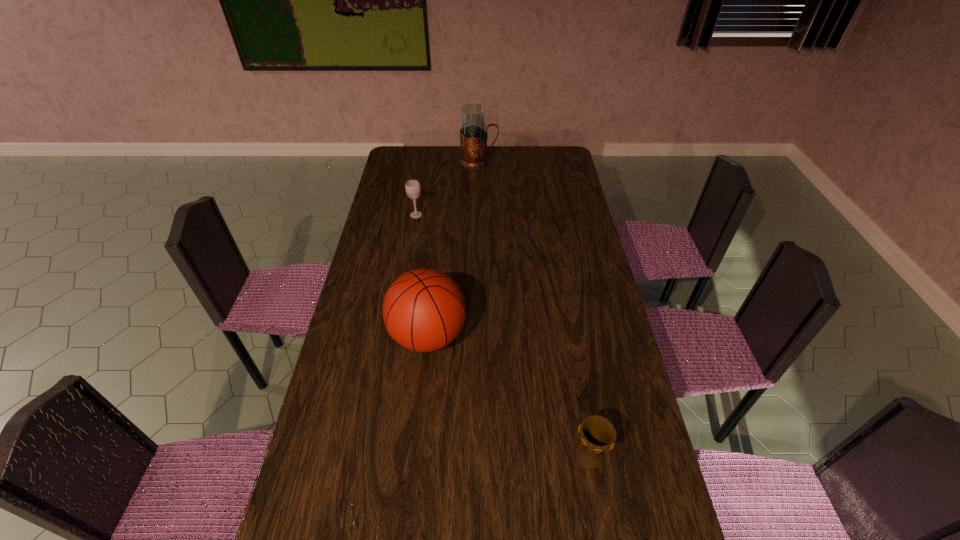
Where is `pitcher`? Image resolution: width=960 pixels, height=540 pixels. pitcher is located at coordinates (473, 133).

This screenshot has height=540, width=960. Identify the location of basketball. (424, 310).

I want to click on wineglass, so click(x=412, y=187).

Image resolution: width=960 pixels, height=540 pixels. I want to click on chalice, so click(x=598, y=434).

Where is `the nearest object`? This screenshot has height=540, width=960. the nearest object is located at coordinates point(598,434).

The height and width of the screenshot is (540, 960). I want to click on blank space located 0.230m with the handle on the side of the pitcher, so click(x=546, y=161).

This screenshot has height=540, width=960. In order to click on vacant area located 0.320m on the back of the second nearest object in this screenshot , I will do `click(438, 244)`.

You are a GUI agent. You are given a task and a screenshot of the screen. Output one action in this format:
    pyautogui.click(x=<x>, y=<y>)
    Task: Click on the blank area located 0.320m on the front of the second farthest object
    
    Given the screenshot: What is the action you would take?
    pyautogui.click(x=406, y=274)

This screenshot has height=540, width=960. I want to click on free region located on the back of the chalice, so click(580, 404).

Identify the location of object located in the far edge section of the desktop. The image size is (960, 540). (473, 133).